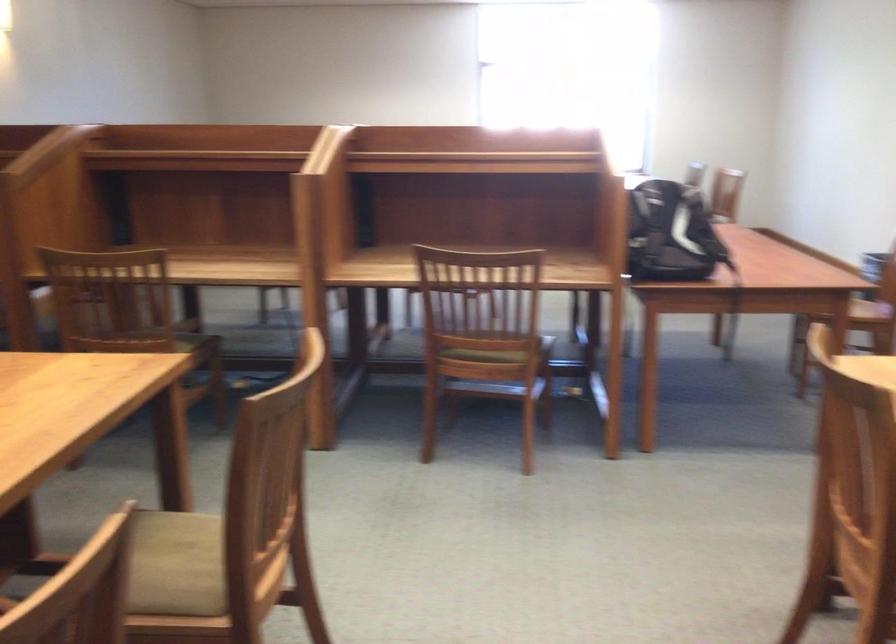
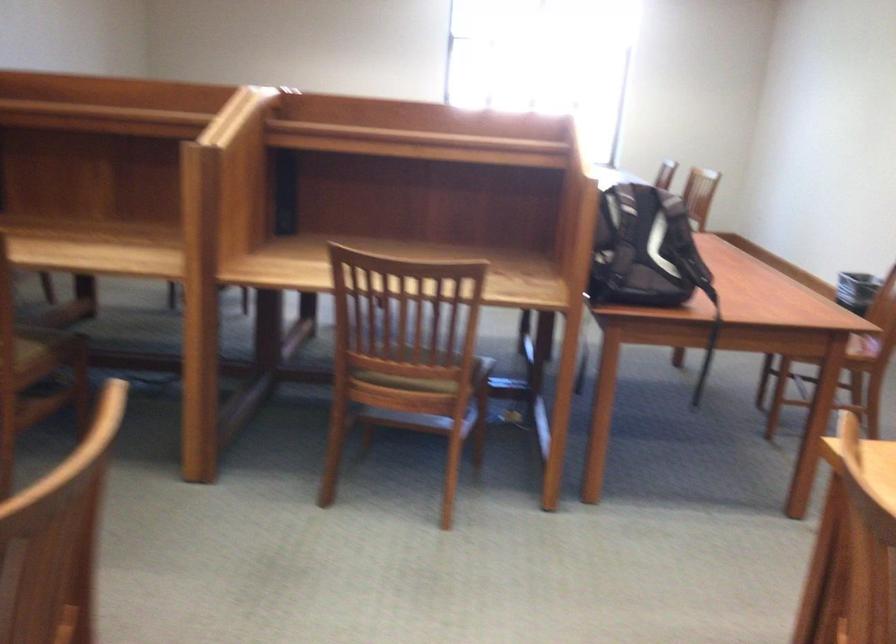
Question: What movement of the cameraman would produce the second image?

Choices:
 (A) Left
 (B) Right
 (C) Forward
 (D) Backward

Answer: (C)